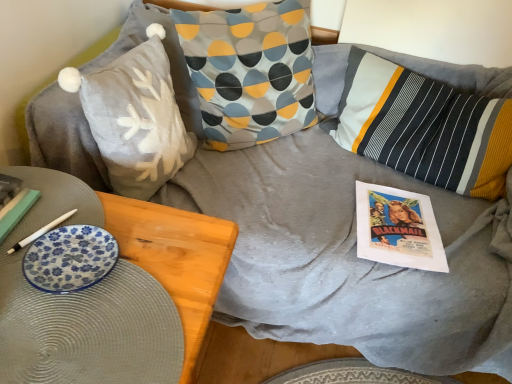
The width and height of the screenshot is (512, 384). Identify the location of free space in front of blue floral plate at lower left. (61, 334).